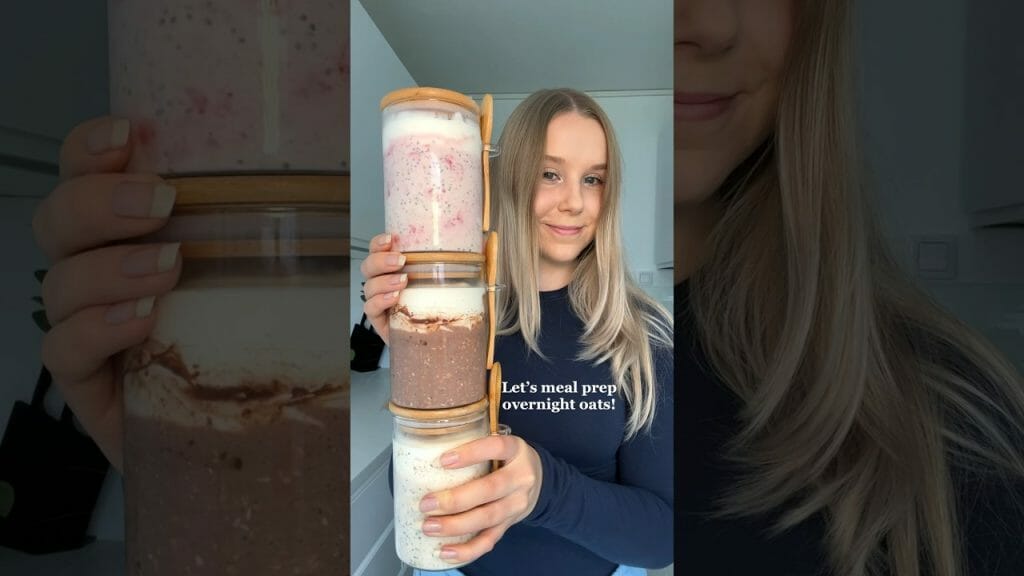
The height and width of the screenshot is (576, 1024). Identify the location of black knife rack. (367, 344).